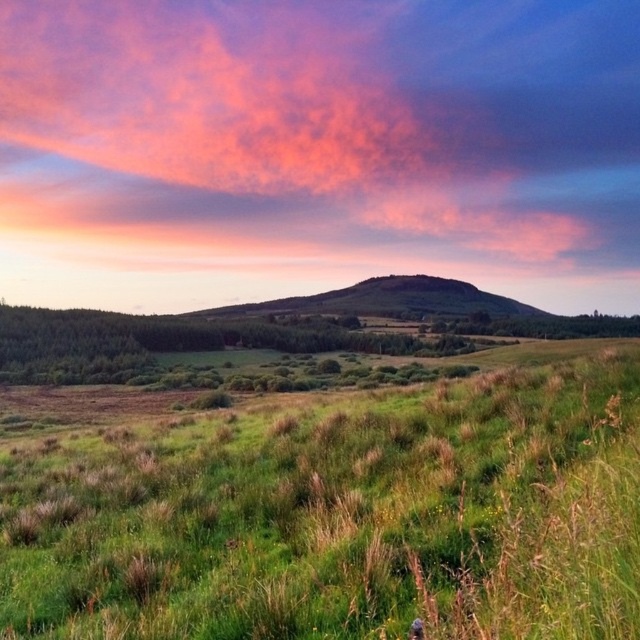
Question: Estimate the real-world distances between objects in this image. Which object is closer to the pink fluffy cloud at upper center?

Choices:
 (A) green grassy field at center
 (B) green grassy hillside at center

Answer: (B)

Question: Is pink fluffy cloud at upper center to the left of green grassy hillside at center from the viewer's perspective?

Choices:
 (A) no
 (B) yes

Answer: (B)

Question: Which object is farther from the camera taking this photo?

Choices:
 (A) green grassy hillside at center
 (B) pink fluffy cloud at upper center
 (C) green grassy field at center

Answer: (B)

Question: In this image, where is pink fluffy cloud at upper center located relative to green grassy hillside at center?

Choices:
 (A) above
 (B) below

Answer: (A)

Question: Is pink fluffy cloud at upper center below green grassy hillside at center?

Choices:
 (A) no
 (B) yes

Answer: (A)

Question: Which point is closer to the camera?

Choices:
 (A) green grassy field at center
 (B) pink fluffy cloud at upper center
 (C) green grassy hillside at center

Answer: (A)